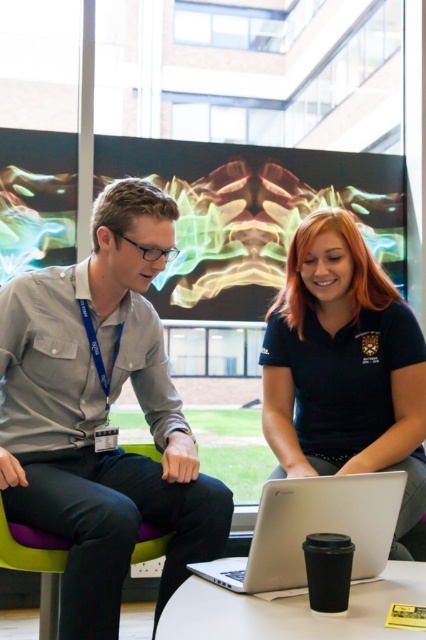
You are a photographer taking a picture of the black matte shirt at center and the silver metallic laptop at center. Which object should you focus on first if you want to capture both clearly in your photo?

The black matte shirt at center is above the silver metallic laptop at center, so you should focus on the silver metallic laptop at center first to ensure both are in focus since it is closer to the camera.

In the scene shown: You are a delivery robot that needs to place a package on the white glossy table at lower center. The package is 25 inches long. Can you fit the package horizontally on the table without it hanging off the edge? Please consider the distance between the black matte shirt at center and the table.

The distance between the black matte shirt at center and the white glossy table at lower center is 24.91 inches. Since the package is 25 inches long, it would slightly exceed the available space, so it cannot be placed horizontally without hanging off the edge.